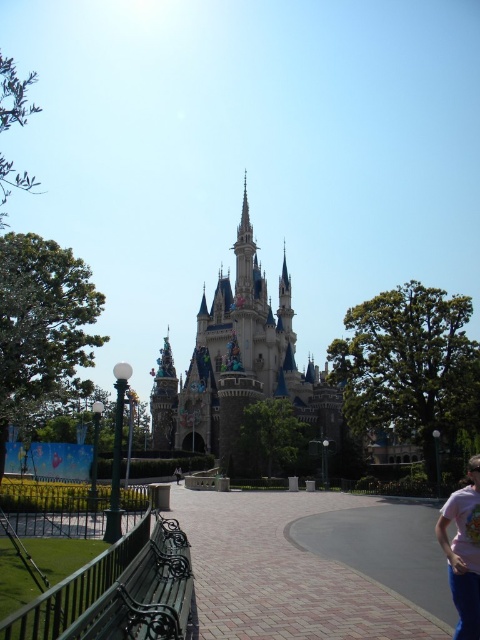
Who is higher up, sandy blue stone castle at center or green wrought iron bench at lower left?

sandy blue stone castle at center

This screenshot has width=480, height=640. I want to click on sandy blue stone castle at center, so [244, 371].

Who is higher up, satin blue castle at center or pink cotton t-shirt at lower right?

satin blue castle at center is higher up.

Can you confirm if satin blue castle at center is positioned above pink cotton t-shirt at lower right?

Yes.

The height and width of the screenshot is (640, 480). What do you see at coordinates (119, 588) in the screenshot? I see `satin blue castle at center` at bounding box center [119, 588].

This screenshot has width=480, height=640. What are the coordinates of `satin blue castle at center` in the screenshot? It's located at (119, 588).

Find the location of a particular element. This screenshot has width=480, height=640. sandy blue stone castle at center is located at coordinates (244, 371).

Does sandy blue stone castle at center have a smaller size compared to satin blue castle at center?

Correct, sandy blue stone castle at center occupies less space than satin blue castle at center.

Locate an element on the screen. sandy blue stone castle at center is located at coordinates (244, 371).

I want to click on sandy blue stone castle at center, so click(x=244, y=371).